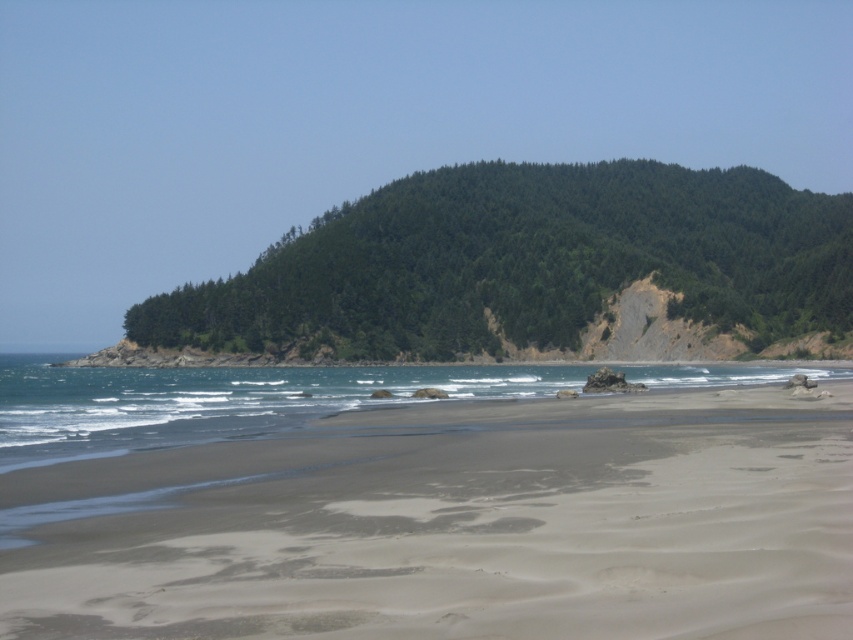
Between sandy beach at lower center and clear blue water at lower center, which one has more height?

clear blue water at lower center is taller.

This screenshot has width=853, height=640. What do you see at coordinates (456, 524) in the screenshot? I see `sandy beach at lower center` at bounding box center [456, 524].

At what (x,y) coordinates should I click in order to perform the action: click on sandy beach at lower center. Please return your answer as a coordinate pair (x, y). Looking at the image, I should click on (456, 524).